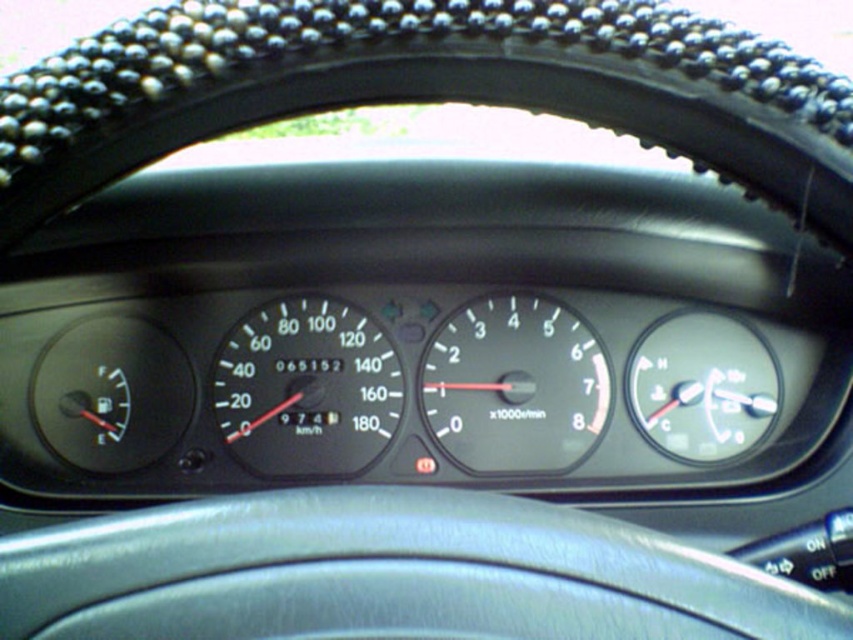
Does point (376, 388) come behind point (543, 454)?

Yes, point (376, 388) is farther from viewer.

Between point (289, 307) and point (534, 323), which one is positioned behind?

The point (534, 323) is behind.

Locate an element on the screen. black plastic speedometer at center is located at coordinates (306, 388).

Who is higher up, black textured steering wheel at center or transparent plastic temperature gauge at right?

Positioned higher is black textured steering wheel at center.

Is point (444, 8) positioned in front of point (660, 406)?

That is True.

Between point (427, 83) and point (708, 317), which one is positioned in front?

Point (427, 83) is in front.

You are a GUI agent. You are given a task and a screenshot of the screen. Output one action in this format:
    pyautogui.click(x=<x>, y=<y>)
    Task: Click on the black textured steering wheel at center
    This screenshot has height=640, width=853.
    Given the screenshot: What is the action you would take?
    pyautogui.click(x=427, y=90)

Is black plastic speedometer at center to the right of transparent plastic temperature gauge at right from the viewer's perspective?

No, black plastic speedometer at center is not to the right of transparent plastic temperature gauge at right.

Image resolution: width=853 pixels, height=640 pixels. In order to click on black plastic speedometer at center in this screenshot , I will do `click(306, 388)`.

Find the location of a particular element. This screenshot has width=853, height=640. black plastic speedometer at center is located at coordinates (306, 388).